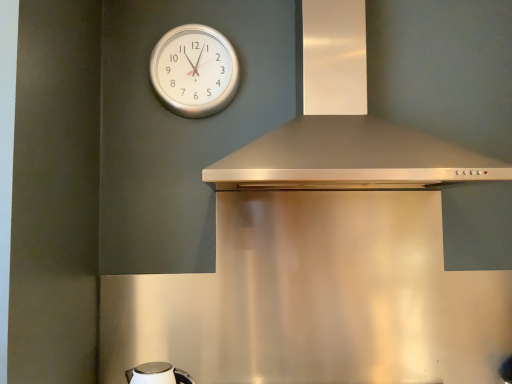
Identify the location of vacant area on top of silver metallic clock at upper center (from a real-world perspective). This screenshot has height=384, width=512. (197, 21).